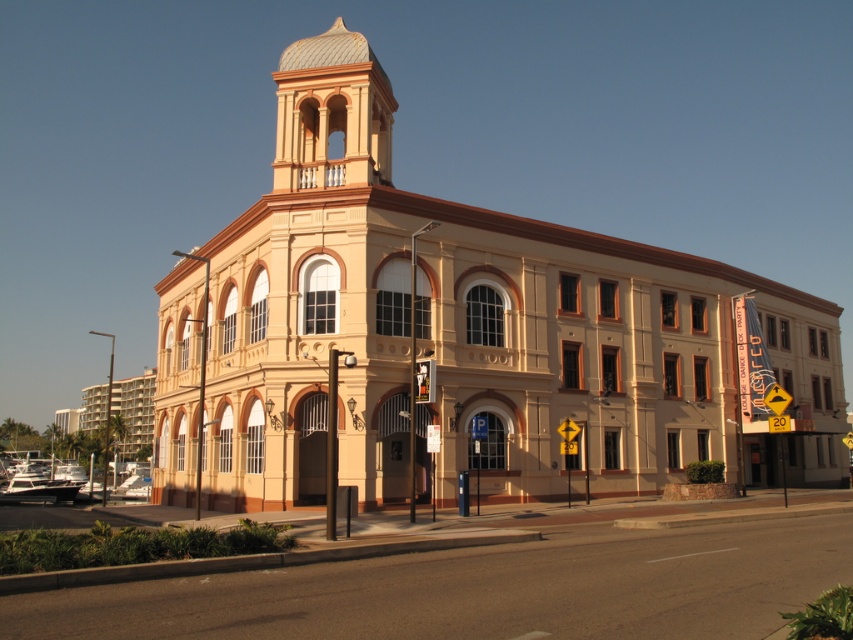
Question: Does beige stone church at center lie behind smooth cream stucco bell tower at upper center?

Choices:
 (A) no
 (B) yes

Answer: (A)

Question: Does beige stone church at center have a greater width compared to smooth cream stucco bell tower at upper center?

Choices:
 (A) no
 (B) yes

Answer: (B)

Question: Can you confirm if beige stone church at center is thinner than smooth cream stucco bell tower at upper center?

Choices:
 (A) no
 (B) yes

Answer: (A)

Question: Which point is closer to the camera?

Choices:
 (A) beige stone church at center
 (B) smooth cream stucco bell tower at upper center

Answer: (A)